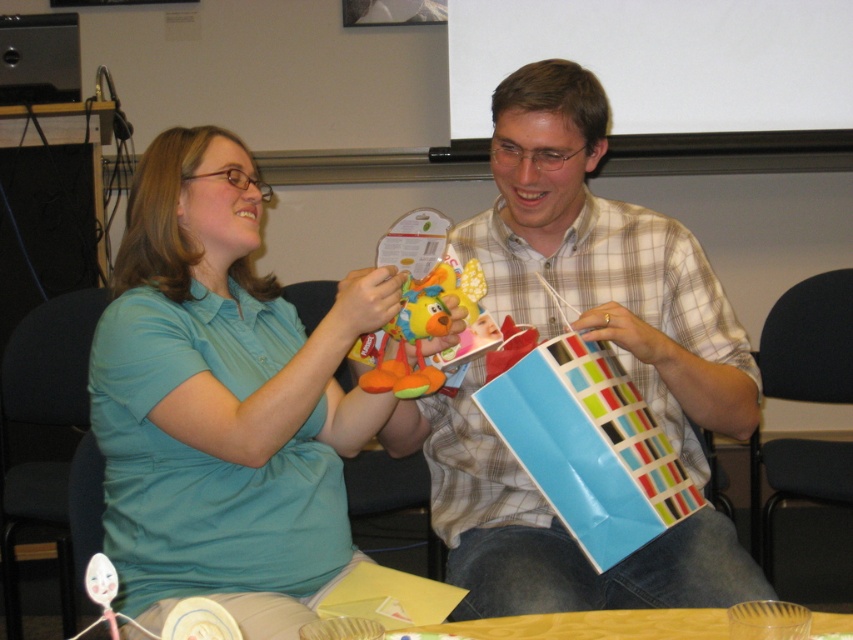
Question: Can you confirm if plaid shirt at center is smaller than soft plush toy at center?

Choices:
 (A) yes
 (B) no

Answer: (B)

Question: Among these objects, which one is nearest to the camera?

Choices:
 (A) soft plush toy at center
 (B) plaid shirt at center

Answer: (B)

Question: Which point appears closest to the camera in this image?

Choices:
 (A) (653, 579)
 (B) (173, 420)

Answer: (B)

Question: Is plaid shirt at center smaller than soft plush toy at center?

Choices:
 (A) yes
 (B) no

Answer: (B)

Question: Does plaid shirt at center appear under soft plush toy at center?

Choices:
 (A) yes
 (B) no

Answer: (A)

Question: Among these points, which one is nearest to the camera?

Choices:
 (A) (730, 577)
 (B) (169, 150)
 (C) (386, 337)

Answer: (A)